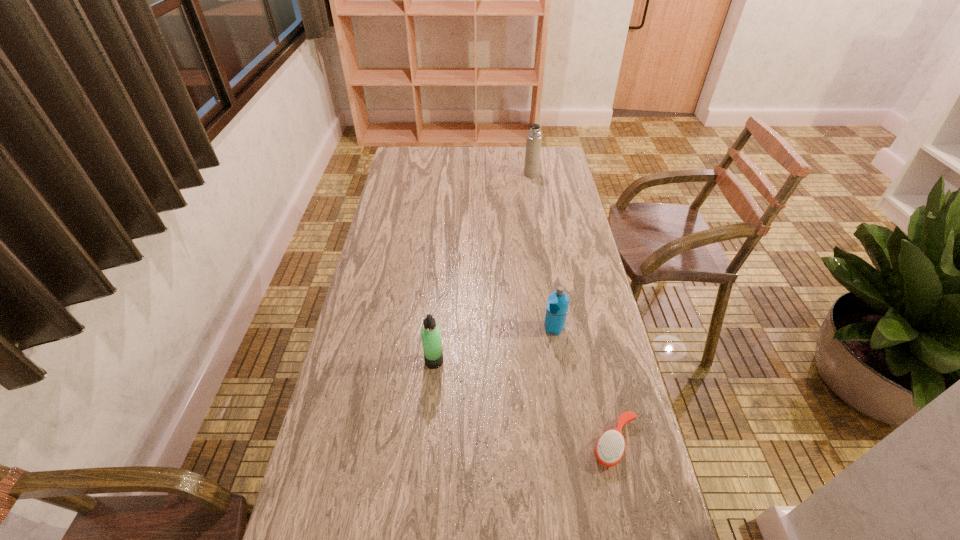
Identify the location of thermos bottle that can be found as the closest to the tallest object. (557, 306).

Image resolution: width=960 pixels, height=540 pixels. Find the location of `vacant position in the image that satisfies the following two spatial constraints: 1. on the front side of the rightmost object; 2. on the right side of the second nearest object`. vacant position in the image that satisfies the following two spatial constraints: 1. on the front side of the rightmost object; 2. on the right side of the second nearest object is located at coordinates (427, 442).